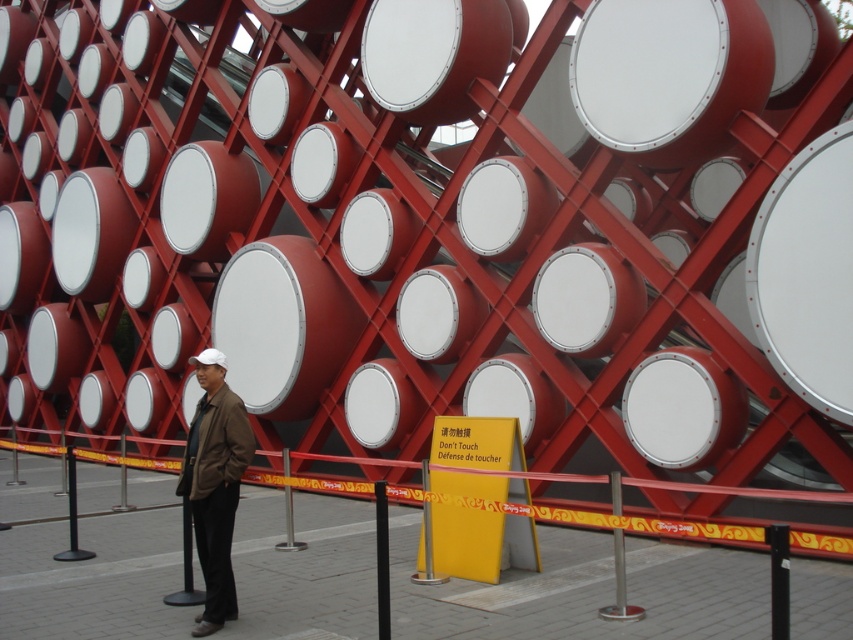
Question: Can you confirm if brown leather jacket at center is positioned to the left of white matte drum at center?

Choices:
 (A) yes
 (B) no

Answer: (A)

Question: Does brown leather jacket at center appear over white matte drum at center?

Choices:
 (A) yes
 (B) no

Answer: (B)

Question: Is brown leather jacket at center wider than white matte drum at center?

Choices:
 (A) no
 (B) yes

Answer: (A)